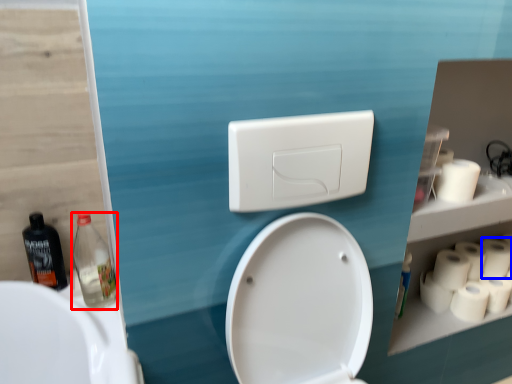
Question: Which of the following is the closest to the observer, bottle (highlighted by a red box) or toilet paper (highlighted by a blue box)?

Choices:
 (A) bottle
 (B) toilet paper

Answer: (A)